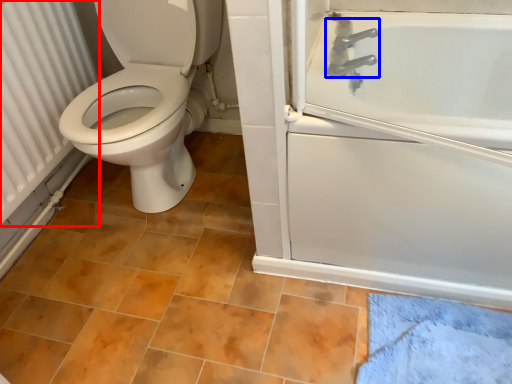
Question: Which object is closer to the camera taking this photo, radiator (highlighted by a red box) or tap (highlighted by a blue box)?

Choices:
 (A) radiator
 (B) tap

Answer: (A)